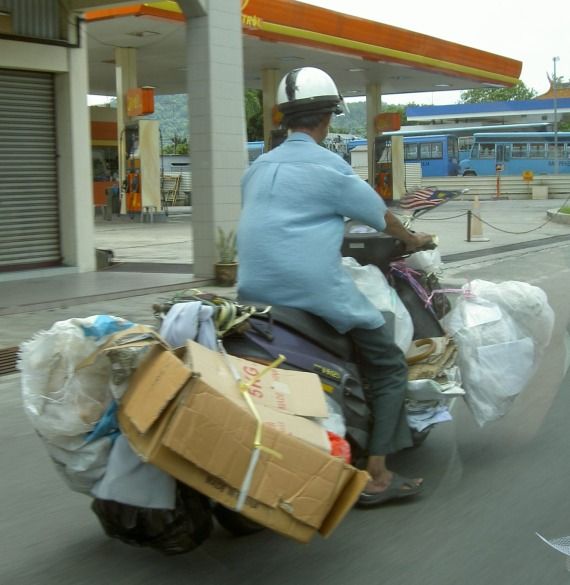
Locate an element on the screen. plant is located at coordinates (226, 247).